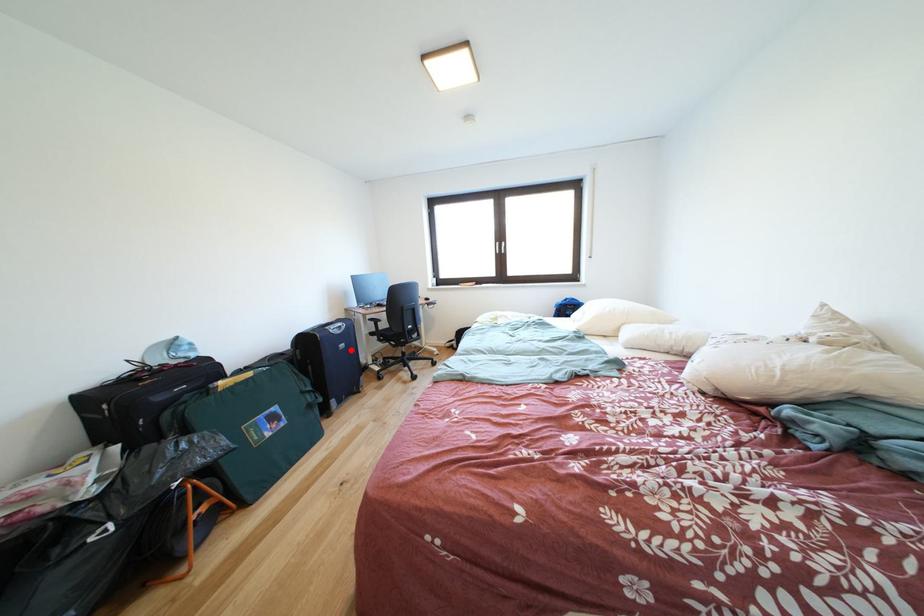
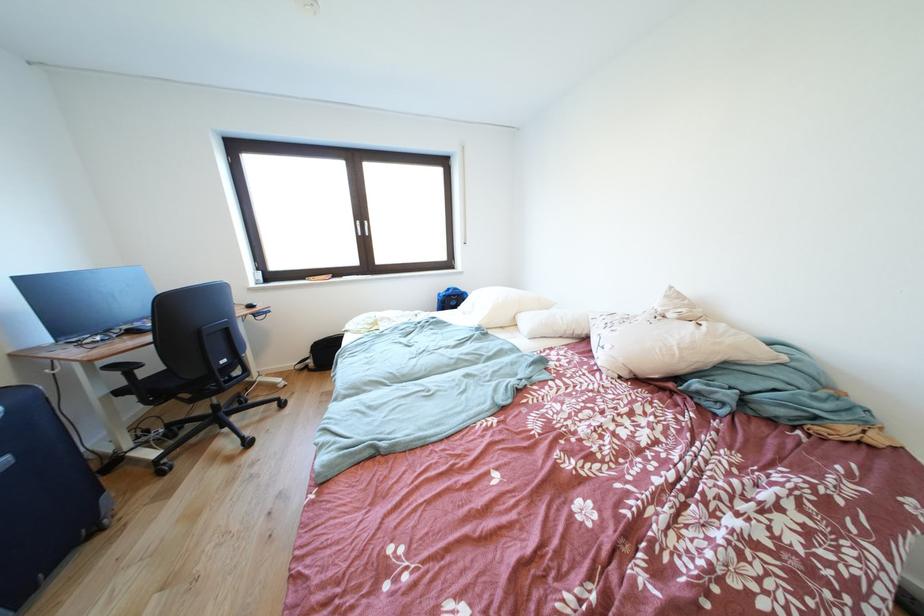
Question: I am providing you with two images of the same scene from different viewpoints. Image1 has a red point marked. In image2, the corresponding 3D location appears at what relative position? Reply with the corresponding letter.

Choices:
 (A) Closer
 (B) Farther

Answer: (B)